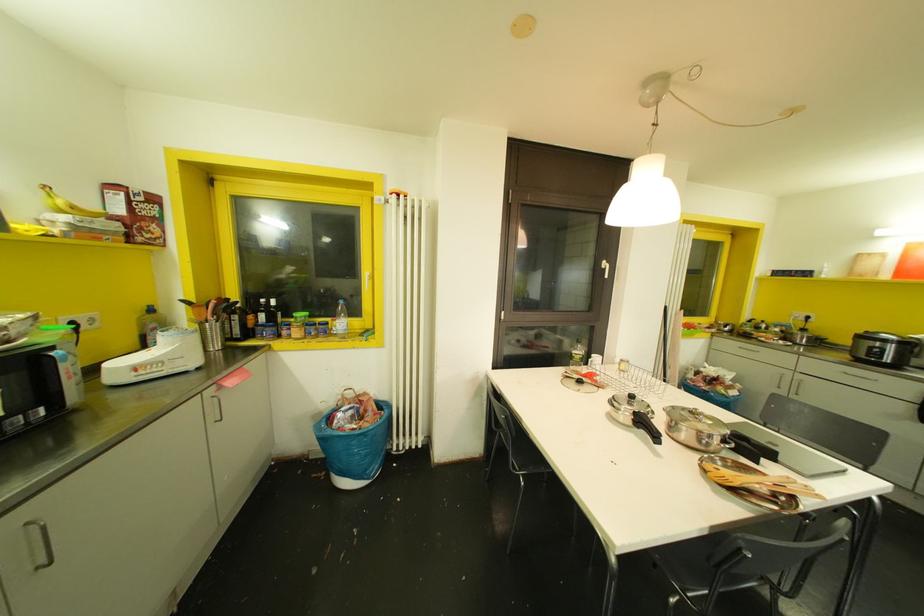
This screenshot has height=616, width=924. What are the coordinates of `white window handle` in the screenshot? It's located at (604, 268).